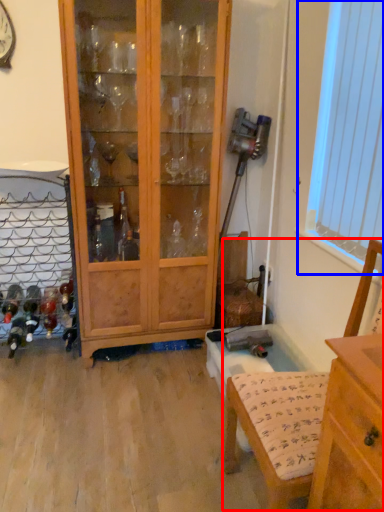
Question: Which object is further to the camera taking this photo, armchair (highlighted by a red box) or window screen (highlighted by a blue box)?

Choices:
 (A) armchair
 (B) window screen

Answer: (B)